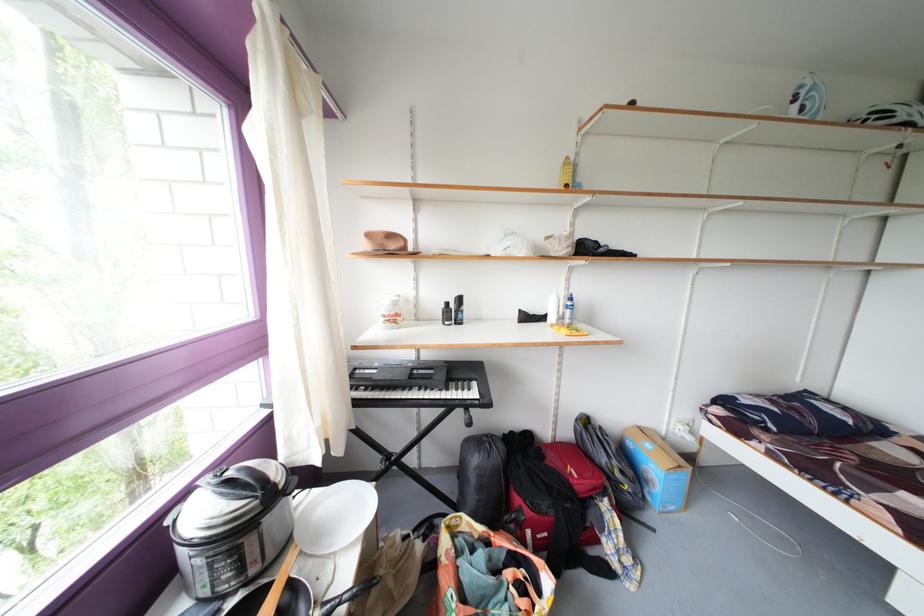
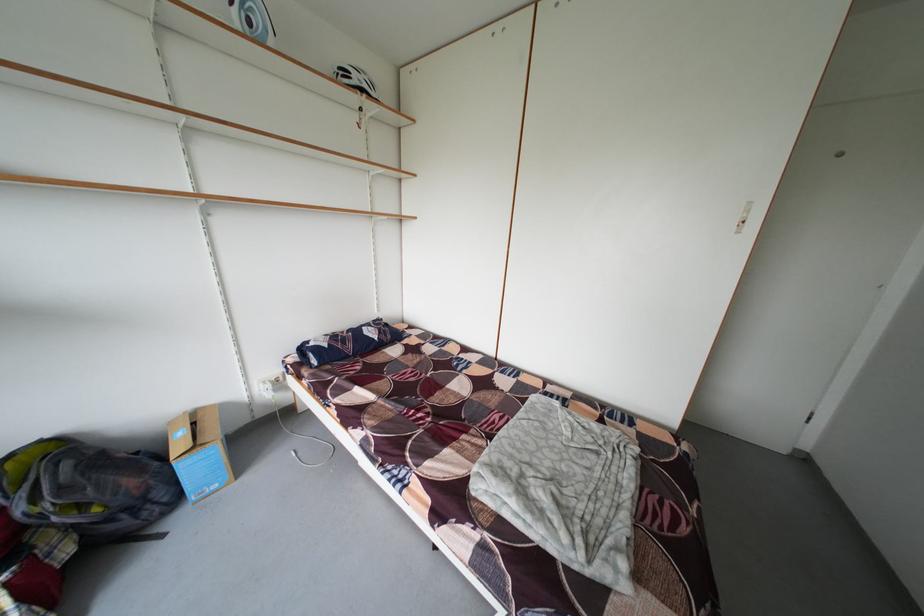
In the second image, find the point that corresponds to (x=823, y=427) in the first image.

(360, 351)